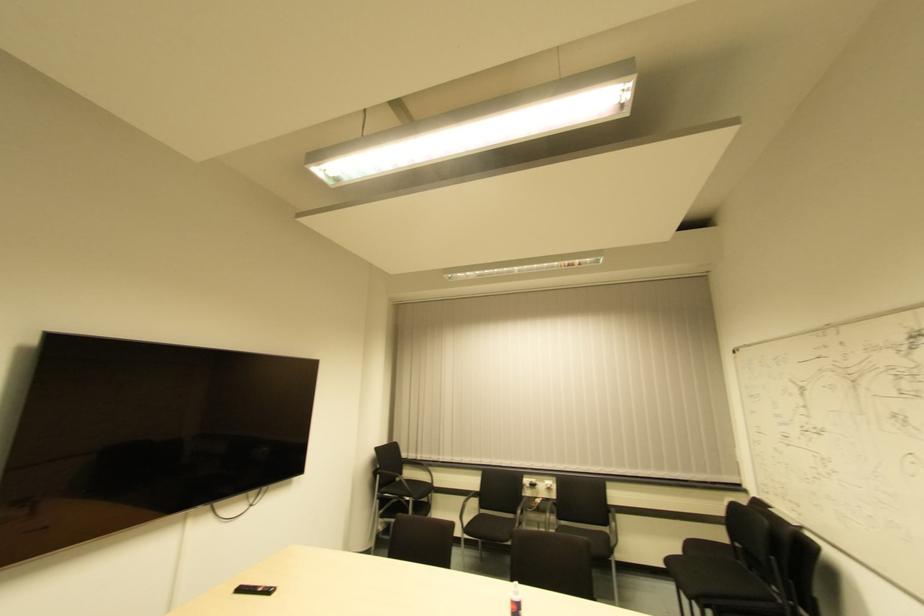
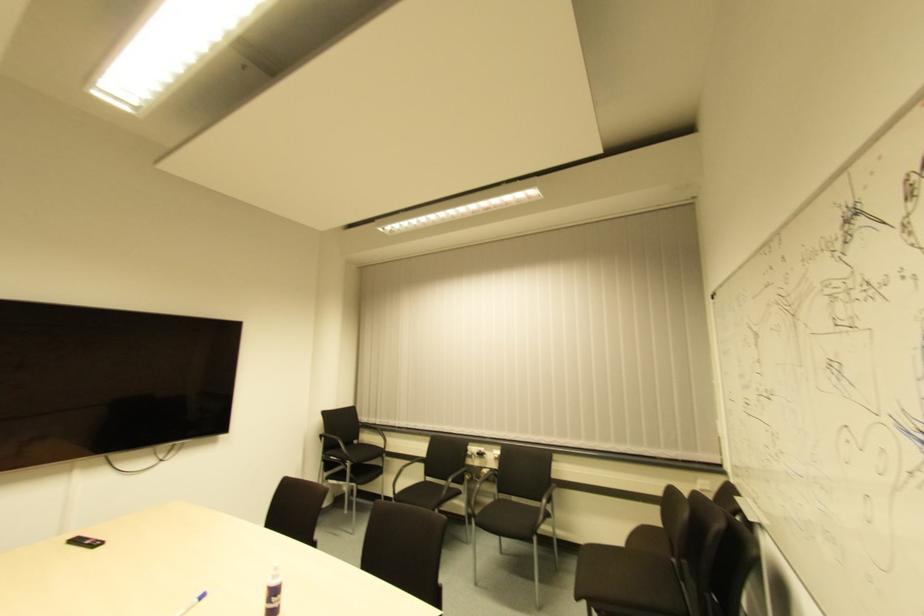
What movement of the cameraman would produce the second image?

The cameraman walked toward right, forward.